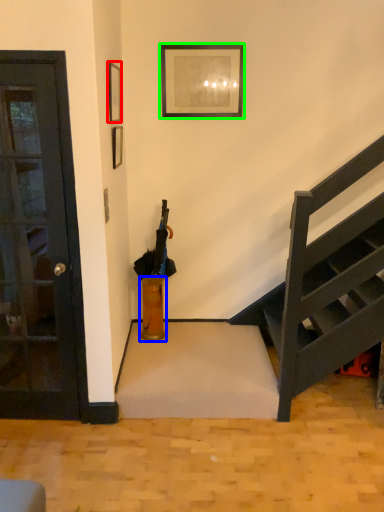
Question: Which object is the closest to the picture frame (highlighted by a red box)? Choose among these: vase (highlighted by a blue box) or picture frame (highlighted by a green box).

Choices:
 (A) vase
 (B) picture frame

Answer: (B)